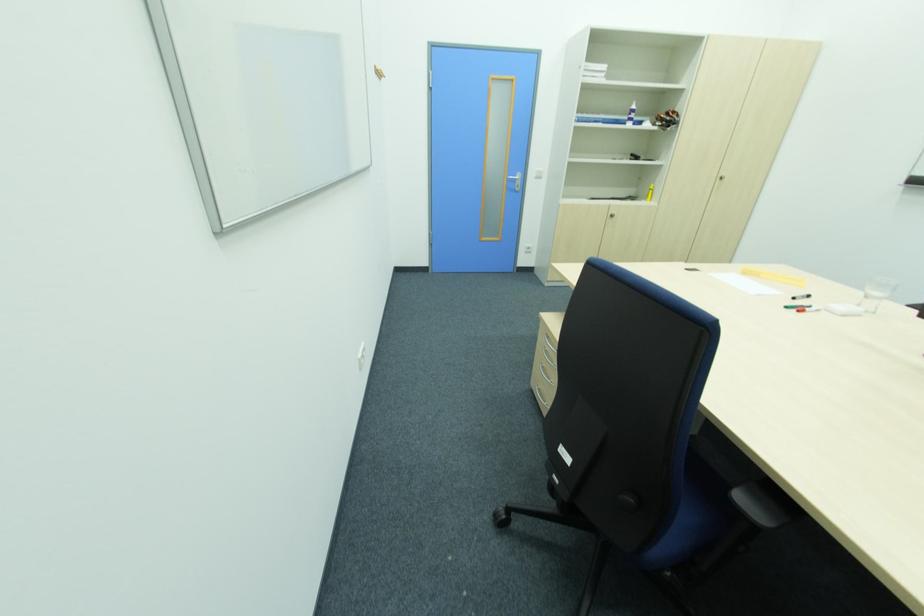
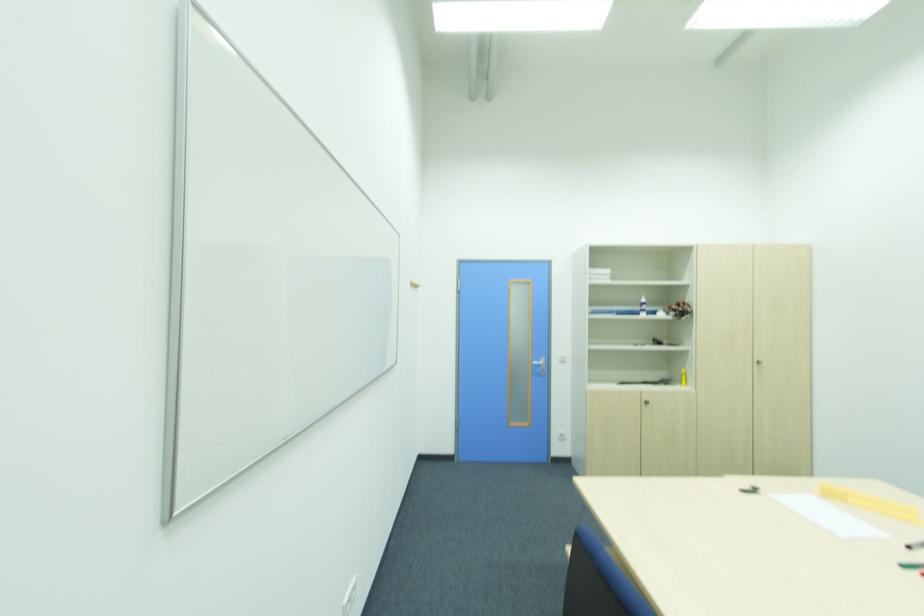
The point at (614, 217) is marked in the first image. Where is the corresponding point in the second image?

(650, 402)